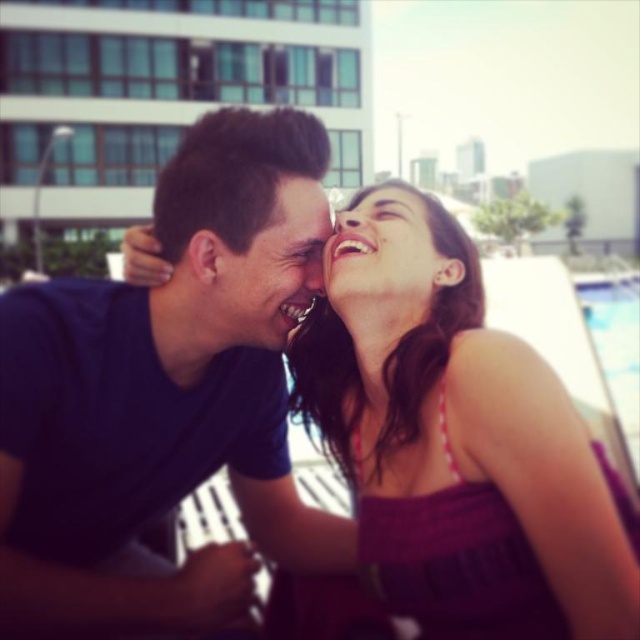
Which is above, dark blue t-shirt at center or matte black forehead at upper center?

matte black forehead at upper center is above.

Is point (24, 544) behind point (307, 177)?

That is False.

Is point (188, 214) positioned after point (282, 180)?

That is False.

You are a GUI agent. You are given a task and a screenshot of the screen. Output one action in this format:
    pyautogui.click(x=<x>, y=<y>)
    Task: Click on the dark blue t-shirt at center
    The image size is (640, 640).
    Given the screenshot: What is the action you would take?
    pyautogui.click(x=163, y=397)

Consider the image. Is dark blue t-shirt at center below matte purple dress at center?

Indeed, dark blue t-shirt at center is positioned under matte purple dress at center.

How far apart are dark blue t-shirt at center and matte purple dress at center?

A distance of 13.33 inches exists between dark blue t-shirt at center and matte purple dress at center.

Locate an element on the screen. The height and width of the screenshot is (640, 640). dark blue t-shirt at center is located at coordinates (163, 397).

Where is `matte black face at center`? matte black face at center is located at coordinates (268, 269).

Which is more to the left, matte black face at center or matte black forehead at upper center?

Positioned to the left is matte black face at center.

Find the location of `matte black face at center`. matte black face at center is located at coordinates (268, 269).